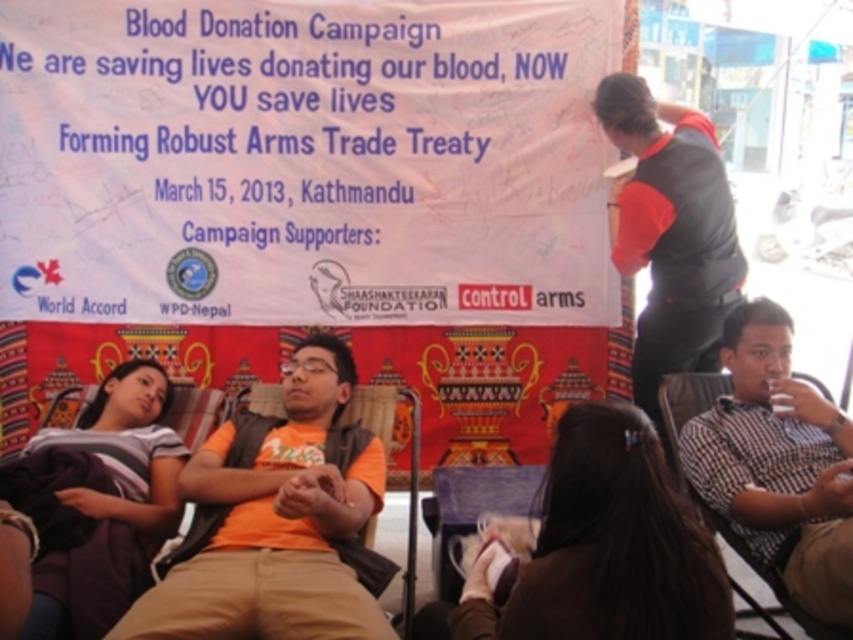
Question: Can you confirm if brown hair at center is wider than checkered fabric shirt at right?

Choices:
 (A) no
 (B) yes

Answer: (B)

Question: Can you confirm if checkered fabric shirt at right is positioned to the left of red-orange sleeve at upper right?

Choices:
 (A) yes
 (B) no

Answer: (B)

Question: Which of these objects is positioned farthest from the brown hair at center?

Choices:
 (A) checkered fabric shirt at right
 (B) orange fabric shirt at center
 (C) gray cotton shirt at lower left
 (D) red-orange sleeve at upper right

Answer: (C)

Question: Which of the following is the closest to the observer?

Choices:
 (A) orange fabric shirt at center
 (B) gray cotton shirt at lower left
 (C) red-orange sleeve at upper right
 (D) checkered fabric shirt at right

Answer: (B)

Question: Which object appears closest to the camera in this image?

Choices:
 (A) orange fabric shirt at center
 (B) red-orange sleeve at upper right

Answer: (A)

Question: Does red-orange sleeve at upper right have a lesser width compared to gray cotton shirt at lower left?

Choices:
 (A) no
 (B) yes

Answer: (A)